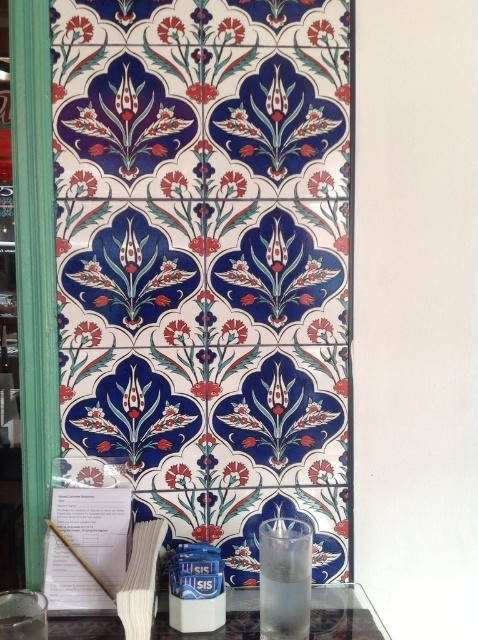
Question: In this image, where is porcelain tiles at center located relative to transparent glass at lower center?

Choices:
 (A) above
 (B) below

Answer: (A)

Question: Which object is closer to the camera taking this photo?

Choices:
 (A) porcelain tiles at center
 (B) transparent glass at lower center

Answer: (B)

Question: Considering the relative positions of porcelain tiles at center and transparent glass at lower center in the image provided, where is porcelain tiles at center located with respect to transparent glass at lower center?

Choices:
 (A) below
 (B) above

Answer: (B)

Question: In this image, where is porcelain tiles at center located relative to transparent glass at lower center?

Choices:
 (A) above
 (B) below

Answer: (A)

Question: Which point is closer to the camera?

Choices:
 (A) (216, 164)
 (B) (312, 632)

Answer: (B)